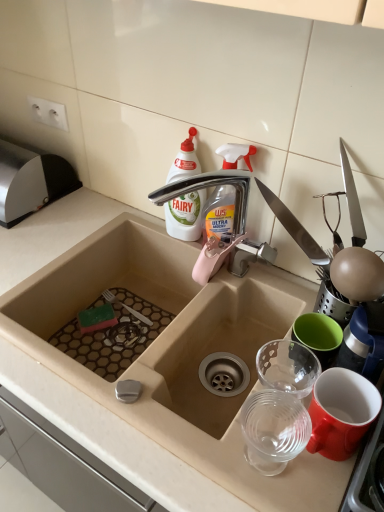
The width and height of the screenshot is (384, 512). Find the location of `vacant area that lies to the right of satin silver knife block at upper left`. vacant area that lies to the right of satin silver knife block at upper left is located at coordinates 76,215.